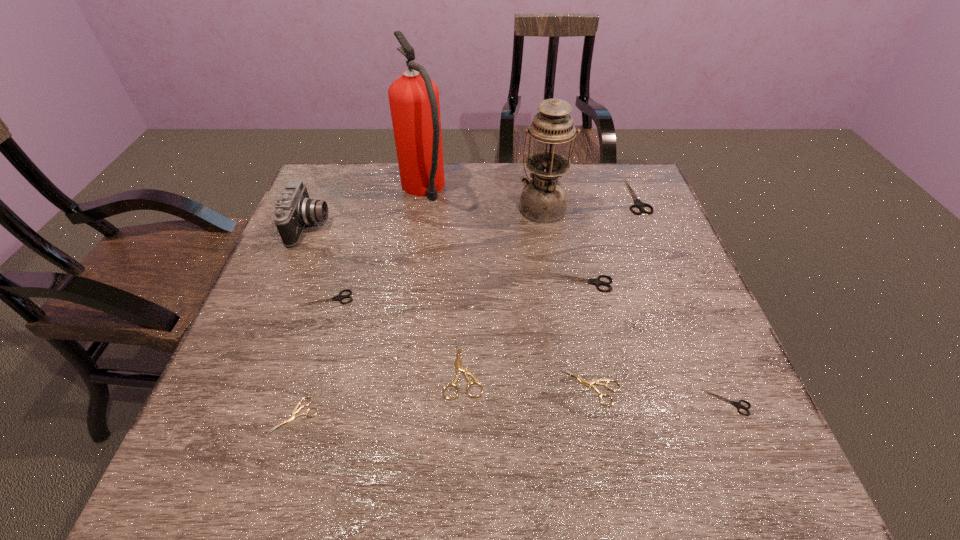
Where is `object that stands as the fourth closest to the shortest shears`? object that stands as the fourth closest to the shortest shears is located at coordinates (589, 383).

Locate an element on the screen. the sixth closest shears relative to the smallest black shears is located at coordinates (339, 297).

Locate an element on the screen. The image size is (960, 540). the fifth closest shears to the second tallest object is located at coordinates (339, 297).

Locate an element on the screen. black shears that is the closest to the smallest black shears is located at coordinates (595, 281).

You are a GUI agent. You are given a task and a screenshot of the screen. Output one action in this format:
    pyautogui.click(x=<x>, y=<y>)
    Task: Click on the fourth closest black shears to the fifth shears from right to left
    This screenshot has width=960, height=540.
    Given the screenshot: What is the action you would take?
    pyautogui.click(x=639, y=204)

Where is `beige shears that is the second closest one to the nearest black shears`? The height and width of the screenshot is (540, 960). beige shears that is the second closest one to the nearest black shears is located at coordinates (459, 367).

Image resolution: width=960 pixels, height=540 pixels. I want to click on beige shears that is the third closest to the smallest black shears, so click(296, 410).

Locate an element on the screen. vacant space that satisfies the following two spatial constraints: 1. on the back side of the ninth shortest object; 2. on the left side of the farthest shears is located at coordinates (540, 196).

Identify the location of free space that satisfies the following two spatial constraints: 1. on the back side of the third biggest black shears; 2. on the left side of the sixth shortest object. The height and width of the screenshot is (540, 960). (332, 283).

Image resolution: width=960 pixels, height=540 pixels. I want to click on blank area in the image that satisfies the following two spatial constraints: 1. on the back side of the second tallest object; 2. on the left side of the third biggest black shears, so coord(356,207).